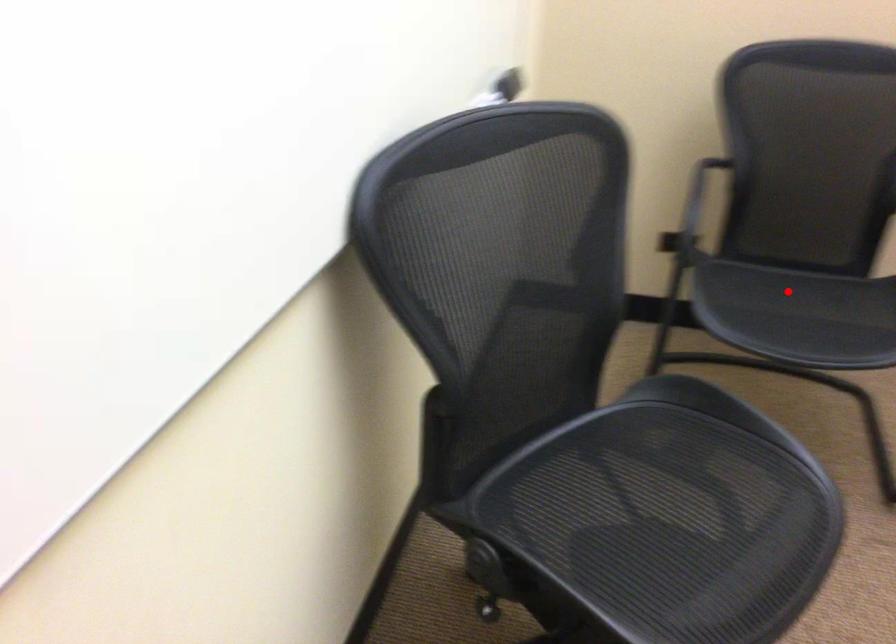
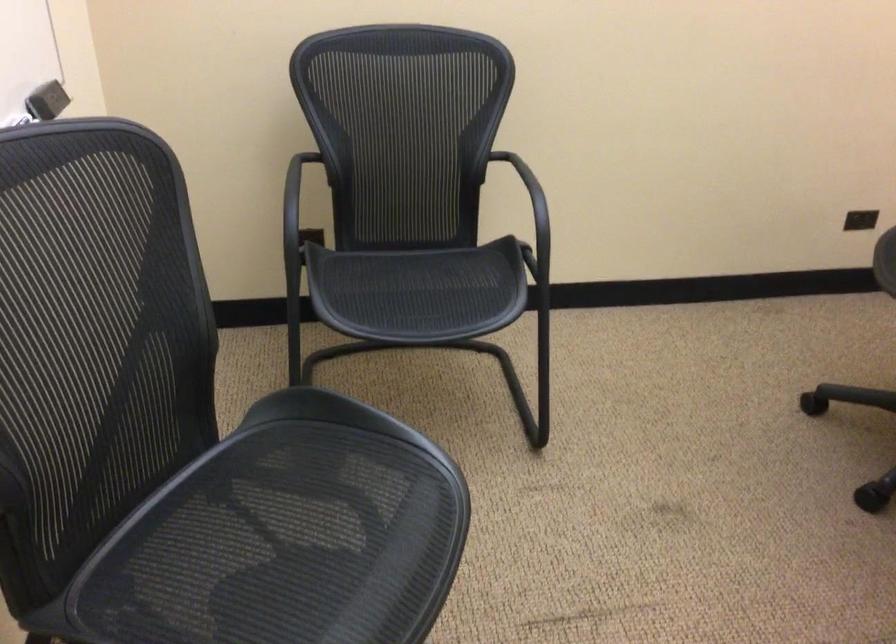
Find the pixel in the second image that matches the highlighted location in the first image.

(409, 287)